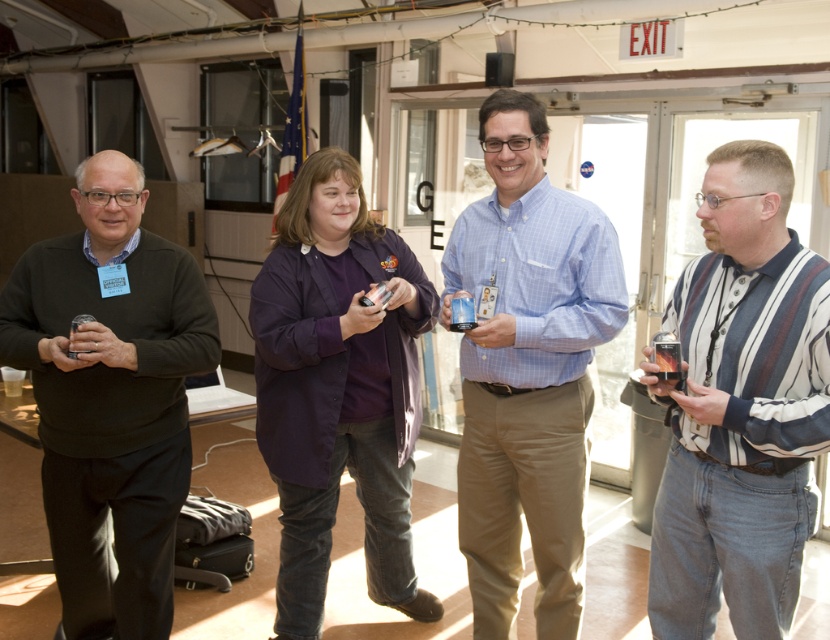
You are organizing a team meeting and need to arrange seating based on the current positions of the striped cotton shirt at right and blue checkered shirt at center. Which shirt should be seated to the left of the other?

The striped cotton shirt at right should be seated to the left of the blue checkered shirt at center because currently, the striped cotton shirt at right is positioned on the right side of the blue checkered shirt at center.

You are organizing a clothing donation drive and need to determine which item takes up more space in the donation box. Based on the image, which clothing item between the striped cotton shirt at right and the dark gray sweater at left is wider?

The striped cotton shirt at right has a lesser width compared to dark gray sweater at left, so the dark gray sweater at left is wider and takes up more space in the donation box.

You are organizing a team photo and need to arrange the striped cotton shirt at right and the blue checkered shirt at center based on their heights. Which shirt should be placed in the back row to ensure visibility?

The striped cotton shirt at right should be placed in the back row because it is shorter than the blue checkered shirt at center, allowing the taller individual in the blue checkered shirt at center to be visible in the front.